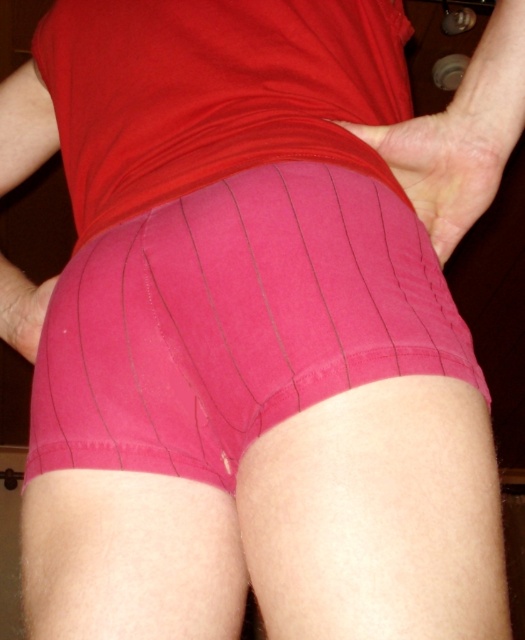
Is pink fabric shorts at center taller than dry skin at center?

Yes, pink fabric shorts at center is taller than dry skin at center.

Is pink fabric shorts at center bigger than dry skin at center?

Indeed, pink fabric shorts at center has a larger size compared to dry skin at center.

Where is `pink fabric shorts at center`? This screenshot has height=640, width=525. pink fabric shorts at center is located at coordinates (236, 321).

Who is lower down, pink fabric shorts at center or pink fabric hand at lower left?

pink fabric shorts at center is lower down.

Between point (152, 332) and point (12, 307), which one is positioned in front?

Point (152, 332)

Identify the location of pink fabric shorts at center. The image size is (525, 640). (236, 321).

Between point (449, 241) and point (36, 342), which one is positioned in front?

Point (449, 241)

Is point (490, 124) positioned before point (26, 316)?

Yes, point (490, 124) is in front of point (26, 316).

Who is more forward, (362,136) or (21,289)?

Point (362,136) is in front.

Image resolution: width=525 pixels, height=640 pixels. I want to click on dry skin at center, so click(447, 161).